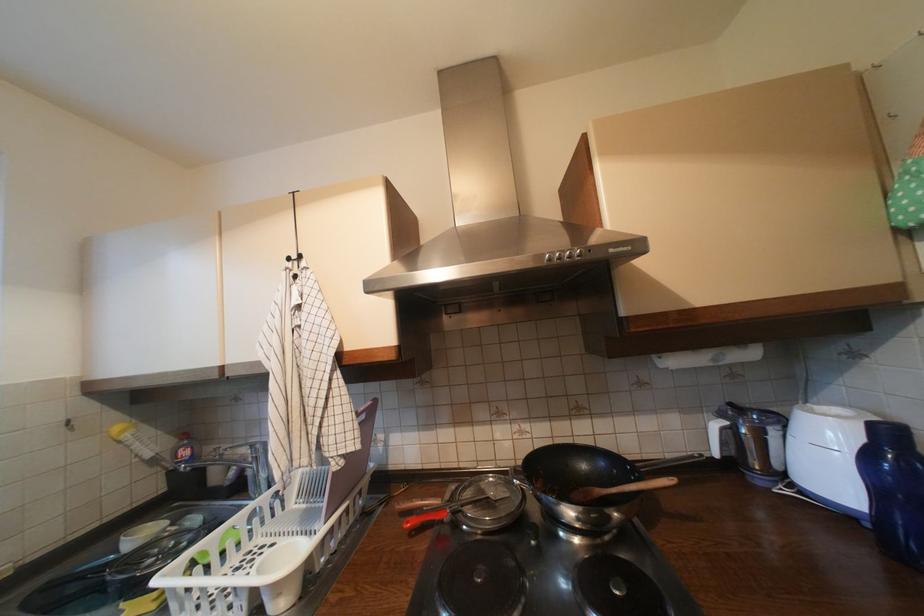
Locate an element on the screen. sink faucet handle is located at coordinates (234, 456).